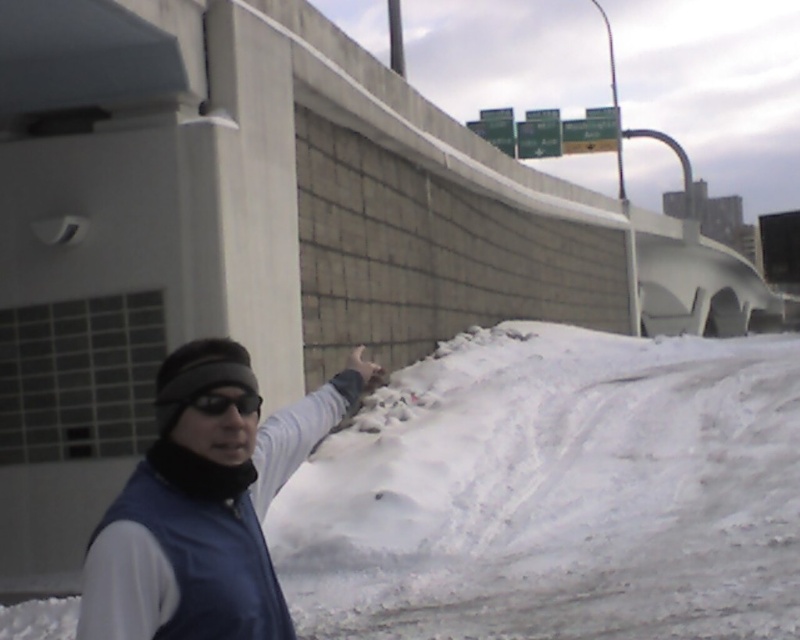
Who is positioned more to the left, blue fabric jacket at center or white matte hand at upper right?

Positioned to the left is blue fabric jacket at center.

Does point (126, 625) lie behind point (358, 369)?

No, (126, 625) is closer to viewer.

Is point (200, 416) positioned after point (356, 371)?

No.

Image resolution: width=800 pixels, height=640 pixels. I want to click on blue fabric jacket at center, so point(204,509).

Who is lower down, white fluffy snow at right or white matte hand at upper right?

white fluffy snow at right is below.

Is white fluffy snow at right below white matte hand at upper right?

Indeed, white fluffy snow at right is positioned under white matte hand at upper right.

Is point (612, 538) positioned in front of point (368, 378)?

No.

Identify the location of white fluffy snow at right. (556, 493).

Based on the photo, who is shorter, blue fabric jacket at center or black matte goggles at upper left?

black matte goggles at upper left

Where is `blue fabric jacket at center`? This screenshot has width=800, height=640. blue fabric jacket at center is located at coordinates (204, 509).